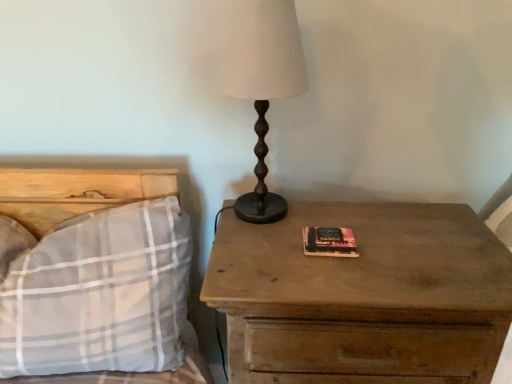
Question: Considering the relative positions of matte brown table lamp at center and wooden nightstand at right in the image provided, is matte brown table lamp at center to the left or to the right of wooden nightstand at right?

Choices:
 (A) left
 (B) right

Answer: (A)

Question: From their relative heights in the image, would you say matte brown table lamp at center is taller or shorter than wooden nightstand at right?

Choices:
 (A) tall
 (B) short

Answer: (B)

Question: Estimate the real-world distances between objects in this image. Which object is closer to the matte brown table lamp at center?

Choices:
 (A) wooden nightstand at right
 (B) plaid fabric pillow at left

Answer: (A)

Question: Which object is positioned closest to the wooden nightstand at right?

Choices:
 (A) matte brown table lamp at center
 (B) plaid fabric pillow at left

Answer: (A)